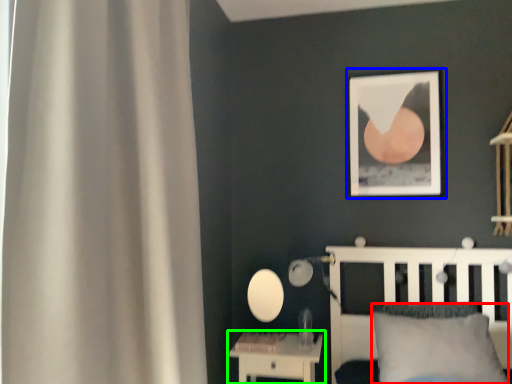
Question: Which is nearer to the pillow (highlighted by a red box)? picture frame (highlighted by a blue box) or nightstand (highlighted by a green box).

Choices:
 (A) picture frame
 (B) nightstand

Answer: (B)